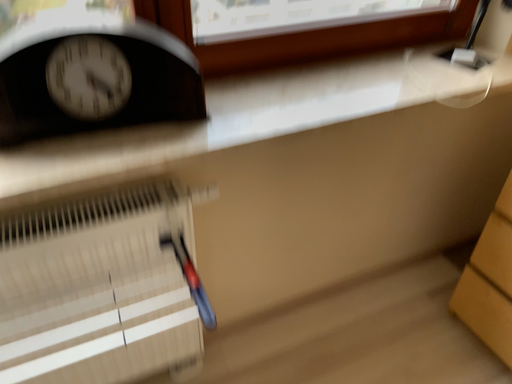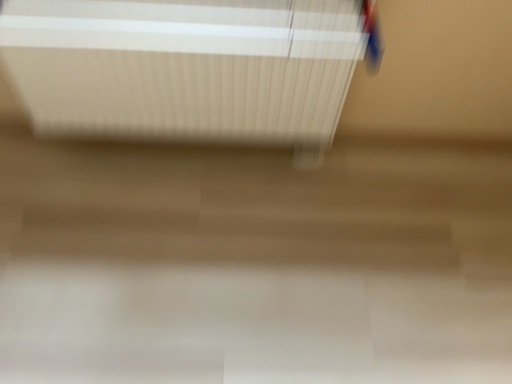
Question: How did the camera likely rotate when shooting the video?

Choices:
 (A) rotated downward
 (B) rotated upward

Answer: (A)